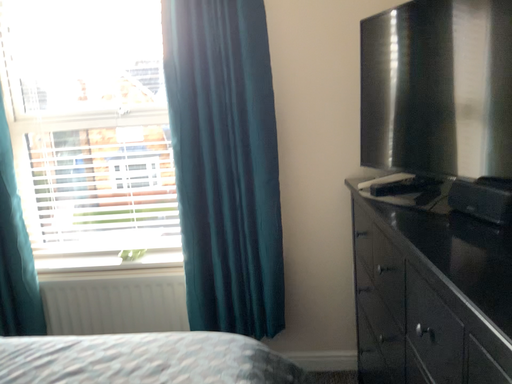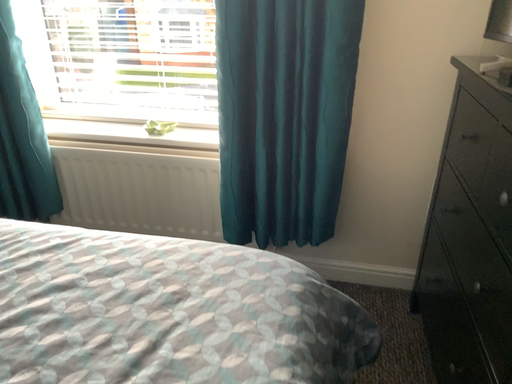
Question: How did the camera likely rotate when shooting the video?

Choices:
 (A) rotated right
 (B) rotated left

Answer: (B)